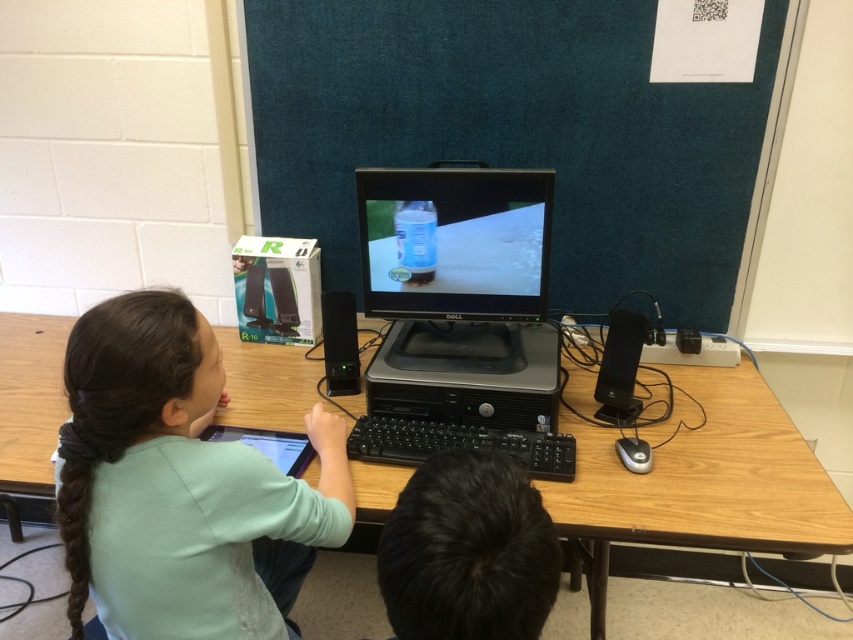
Between light green shirt at center and matte black monitor at center, which one appears on the left side from the viewer's perspective?

light green shirt at center

Can you confirm if light green shirt at center is positioned below matte black monitor at center?

Yes, light green shirt at center is below matte black monitor at center.

What do you see at coordinates (178, 484) in the screenshot? I see `light green shirt at center` at bounding box center [178, 484].

This screenshot has width=853, height=640. I want to click on light green shirt at center, so click(x=178, y=484).

Is point (717, 300) positioned behind point (189, 460)?

Yes, point (717, 300) is farther from viewer.

Between point (621, 276) and point (225, 480), which one is positioned behind?

The point (621, 276) is more distant.

This screenshot has width=853, height=640. What are the coordinates of `teal fabric bulletin board at upper center` in the screenshot? It's located at (515, 132).

Between wooden table at center and matte black monitor at center, which one appears on the right side from the viewer's perspective?

wooden table at center

Is point (703, 545) positioned in front of point (480, 193)?

That is True.

At what (x,y) coordinates should I click in order to perform the action: click on wooden table at center. Please return your answer as a coordinate pair (x, y). This screenshot has height=640, width=853. Looking at the image, I should click on 706,476.